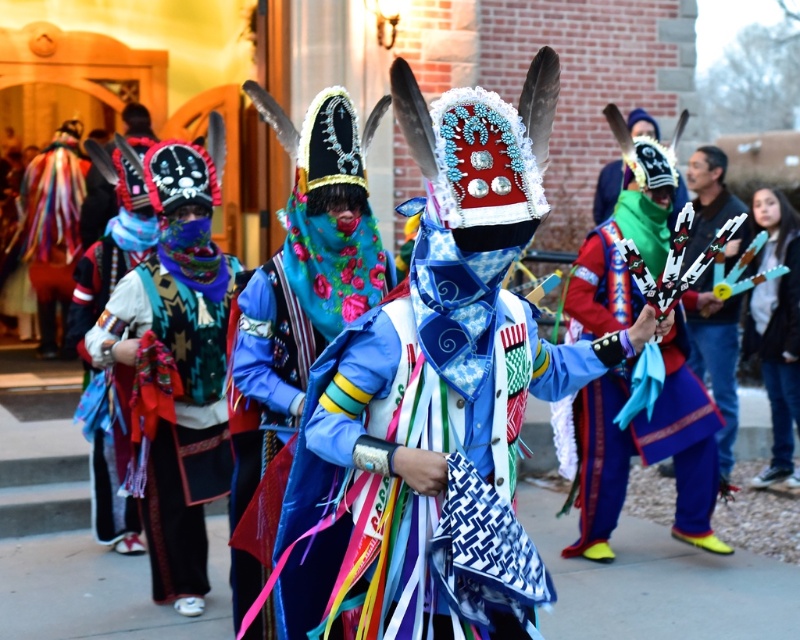
Looking at this image, which is below, blue woven fabric headdress at center or denim jacket at lower right?

blue woven fabric headdress at center is lower down.

Is blue woven fabric headdress at center above denim jacket at lower right?

Actually, blue woven fabric headdress at center is below denim jacket at lower right.

Does point (600, 449) lie behind point (754, 209)?

No.

The width and height of the screenshot is (800, 640). What are the coordinates of `blue woven fabric headdress at center` in the screenshot? It's located at (646, 448).

Between matte black mask at center and blue denim jeans at right, which one has more height?

With more height is blue denim jeans at right.

Which is in front, point (208, 160) or point (692, 205)?

Point (208, 160)

What do you see at coordinates (176, 364) in the screenshot? I see `matte black mask at center` at bounding box center [176, 364].

Locate an element on the screen. matte black mask at center is located at coordinates (176, 364).

Who is positioned more to the left, blue satin headdress at center or blue denim jeans at right?

blue satin headdress at center is more to the left.

The width and height of the screenshot is (800, 640). Describe the element at coordinates (304, 285) in the screenshot. I see `blue satin headdress at center` at that location.

Find the location of a particular element. Image resolution: width=800 pixels, height=640 pixels. blue satin headdress at center is located at coordinates (304, 285).